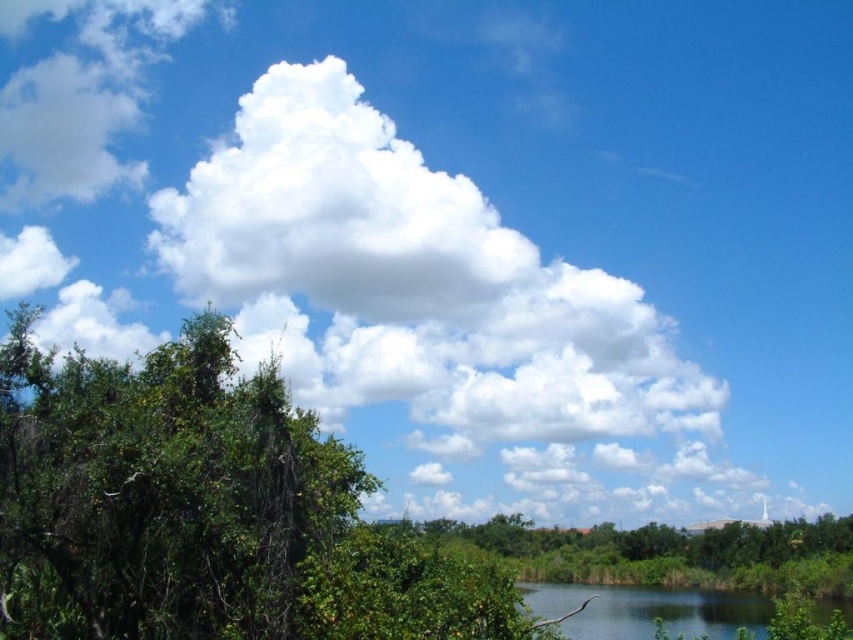
Question: Which point is closer to the camera taking this photo?

Choices:
 (A) (550, 577)
 (B) (561, 596)

Answer: (B)

Question: Which point is farther to the camera?

Choices:
 (A) (549, 586)
 (B) (486, 536)
 (C) (68, 369)

Answer: (B)

Question: Where is green leafy tree at left located in relation to green grassy river at lower right in the image?

Choices:
 (A) right
 (B) left

Answer: (B)

Question: Which object is the closest to the green leafy tree at left?

Choices:
 (A) green leafy tree at lower center
 (B) green grassy river at lower right

Answer: (B)

Question: Does green leafy tree at left have a greater width compared to green grassy river at lower right?

Choices:
 (A) yes
 (B) no

Answer: (B)

Question: From the image, what is the correct spatial relationship of green leafy tree at left in relation to green leafy tree at lower center?

Choices:
 (A) left
 (B) right

Answer: (A)